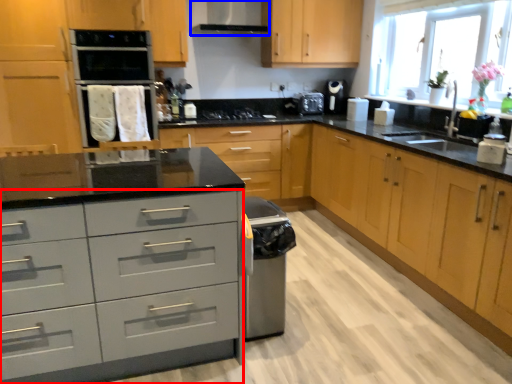
Question: Which object is closer to the camera taking this photo, drawer (highlighted by a red box) or exhaust hood (highlighted by a blue box)?

Choices:
 (A) drawer
 (B) exhaust hood

Answer: (A)